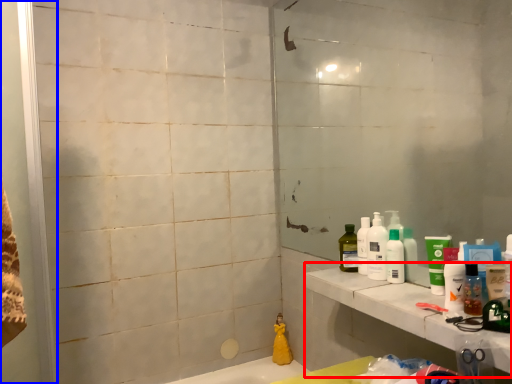
Question: Which point is further to the camera, counter top (highlighted by a red box) or screen door (highlighted by a blue box)?

Choices:
 (A) counter top
 (B) screen door

Answer: (A)